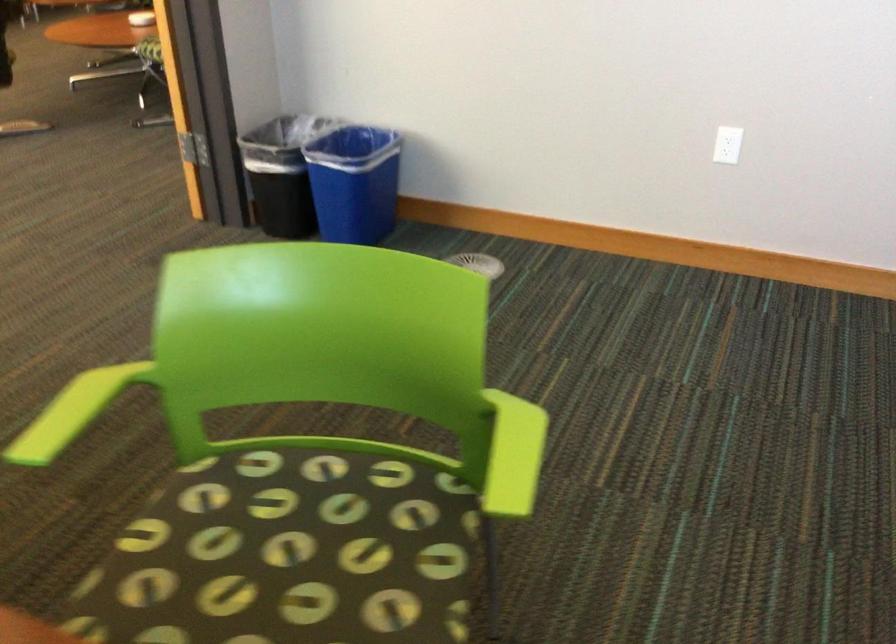
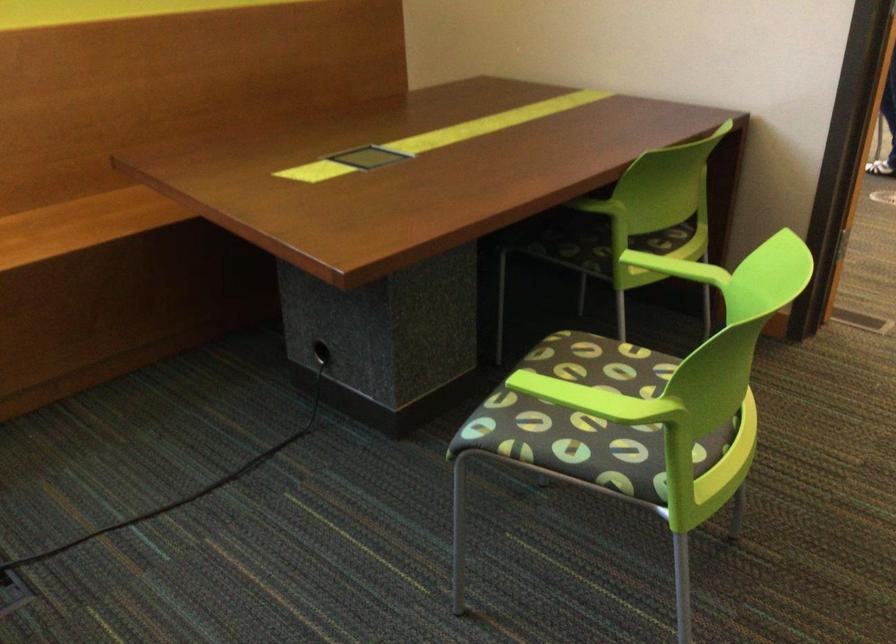
Locate, in the second image, the point that corresponds to the point at 507,444 in the first image.

(599, 399)